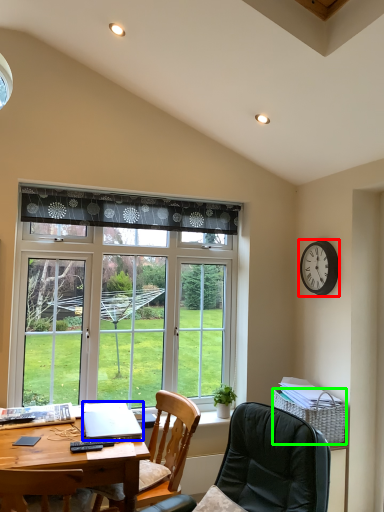
Question: Which object is the farthest from clock (highlighted by a red box)? Choose among these: laptop (highlighted by a blue box) or picnic basket (highlighted by a green box).

Choices:
 (A) laptop
 (B) picnic basket

Answer: (A)